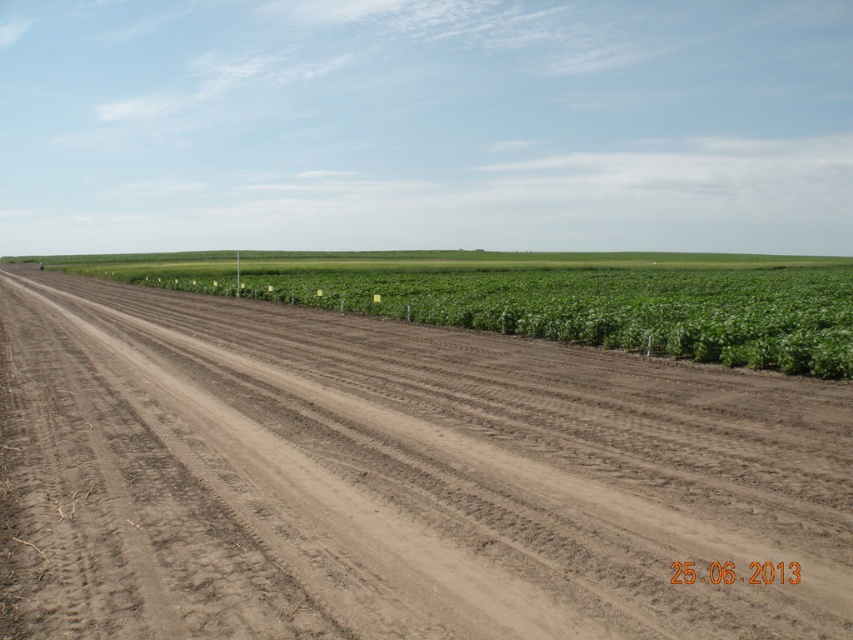
Can you confirm if brown soil at center is thinner than green leafy plant at center?

Indeed, brown soil at center has a lesser width compared to green leafy plant at center.

Which of these two, brown soil at center or green leafy plant at center, stands shorter?

Standing shorter between the two is brown soil at center.

Is point (28, 512) more distant than point (329, 268)?

No.

Where is `brown soil at center`? This screenshot has width=853, height=640. brown soil at center is located at coordinates click(403, 477).